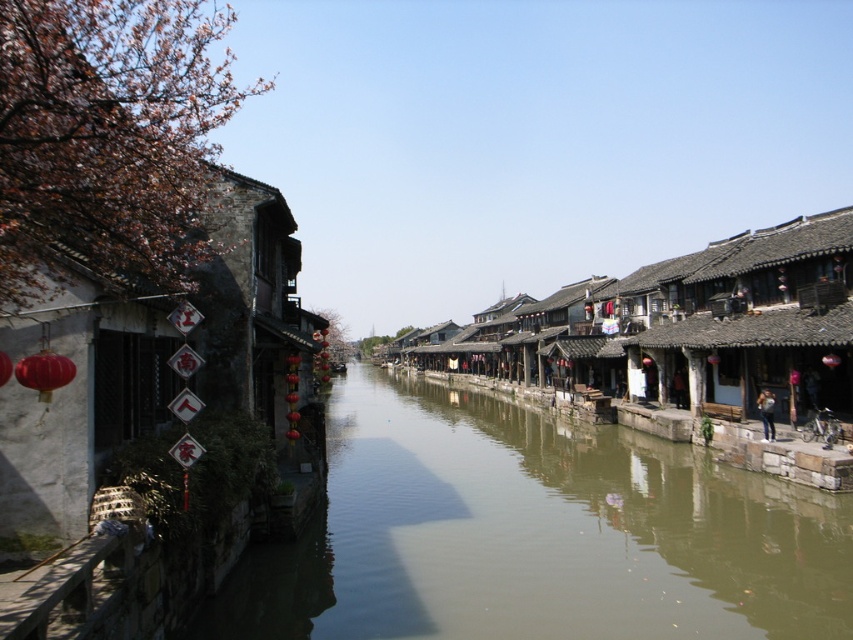
Can you confirm if greenish-brown water at center is wider than rustic wooden hut at center?

No.

Locate an element on the screen. greenish-brown water at center is located at coordinates (534, 534).